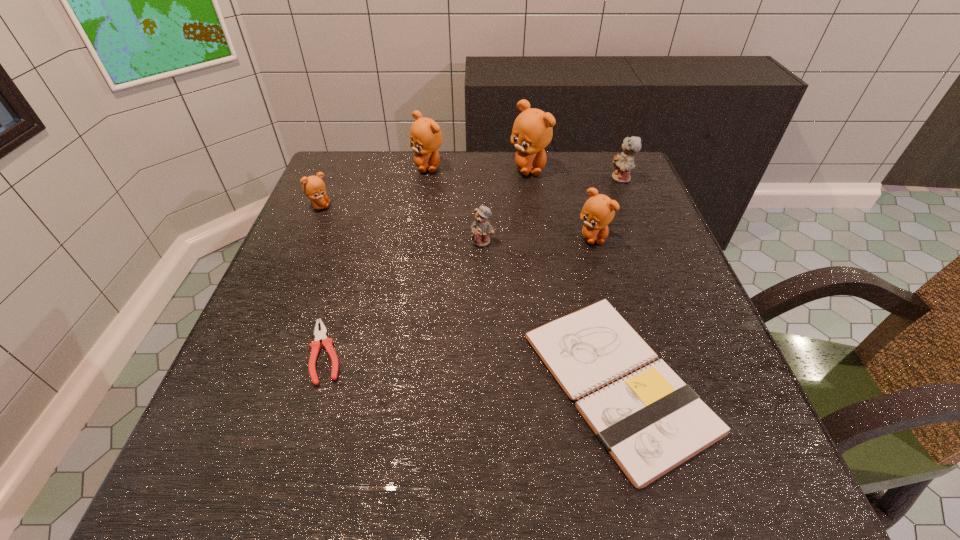
The height and width of the screenshot is (540, 960). Find the location of `object that is at the far right corner`. object that is at the far right corner is located at coordinates (623, 163).

Find the location of a particular element. object present at the near right corner is located at coordinates (650, 422).

Identify the location of vacant space at the far edge of the desktop. This screenshot has height=540, width=960. (574, 198).

This screenshot has height=540, width=960. In order to click on free space at the near edge of the desktop in this screenshot , I will do `click(315, 446)`.

The height and width of the screenshot is (540, 960). I want to click on free region at the left edge of the desktop, so click(x=324, y=214).

Image resolution: width=960 pixels, height=540 pixels. I want to click on vacant space at the right edge of the desktop, so click(630, 240).

The width and height of the screenshot is (960, 540). I want to click on blank space at the far left corner of the desktop, so [x=378, y=169].

In the image, there is a desktop. Identify the location of vacant space at the near left corner. This screenshot has height=540, width=960. (204, 472).

In the image, there is a desktop. Where is `vacant space at the far right corner`? vacant space at the far right corner is located at coordinates (596, 164).

You are a GUI agent. You are given a task and a screenshot of the screen. Output one action in this format:
    pyautogui.click(x=<x>, y=<y>)
    Task: Click on the empty space between the third object from left to right and the pliers
    The image size is (960, 540).
    Given the screenshot: What is the action you would take?
    pyautogui.click(x=377, y=259)